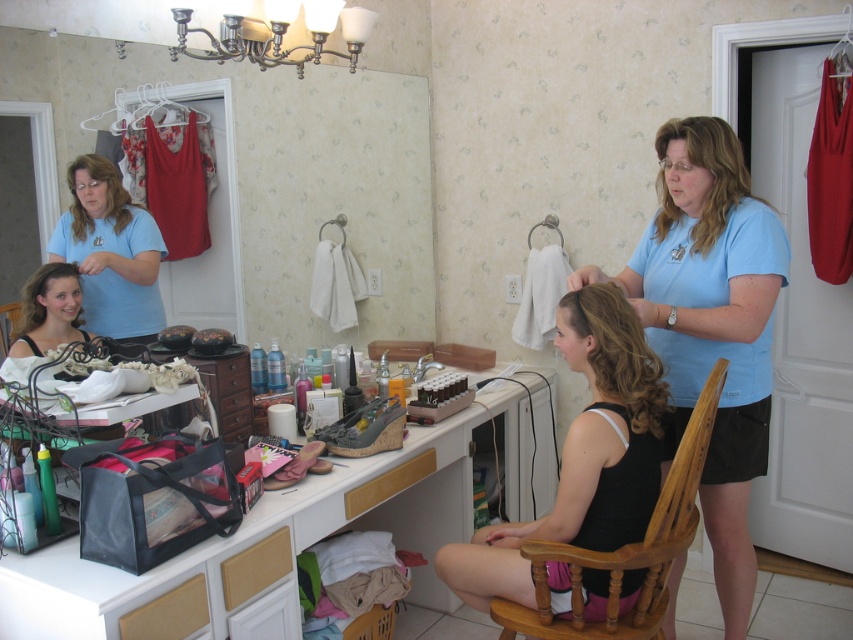
You are standing in the bathroom and want to see the reflection of both the matte blue shirt at center and the matte black hair at center in the vanity mirror. Which one do you think will be visible first in the reflection?

The matte blue shirt at center will be visible first in the reflection because it is in front of the matte black hair at center, so it will appear closer in the mirror.

You are a hair stylist observing the two women in the bathroom. The first woman has dark brown silky hair at center, and the second has blonde matte hair at center. Which of their hair is shorter?

The dark brown silky hair at center is smaller than the blonde matte hair at center, so the dark brown silky hair at center is shorter.

You are a photographer standing at the camera position. You want to capture a closeup shot of the dark brown silky hair at center. The camera can focus on objects within 1.5 meters. Can you take the photo without moving the camera or the subject?

The dark brown silky hair at center is 1.97 meters away from the camera, which is beyond the 1.5 meters focusing range. Therefore, you cannot take the closeup shot without adjusting the camera or subject position.